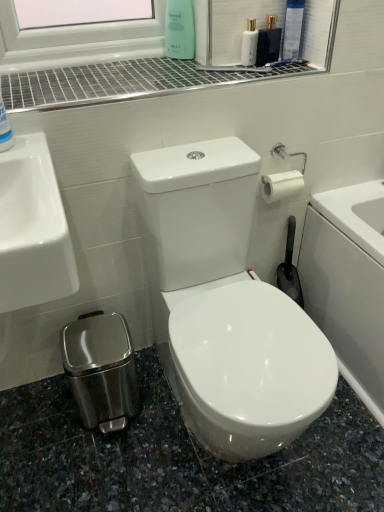
You are a GUI agent. You are given a task and a screenshot of the screen. Output one action in this format:
    pyautogui.click(x=<x>, y=<y>)
    Task: Click on the blue glossy bottle at upper left, which appears as the 2th cleaning product when viewed from the back
    This screenshot has height=512, width=384.
    Given the screenshot: What is the action you would take?
    pyautogui.click(x=5, y=129)

Where is `green matte bottle at upper center, which appears as the 1th cleaning product when viewed from the top`? The image size is (384, 512). green matte bottle at upper center, which appears as the 1th cleaning product when viewed from the top is located at coordinates (179, 29).

The width and height of the screenshot is (384, 512). I want to click on blue glossy bottle at upper left, positioned as the first cleaning product in bottom-to-top order, so click(5, 129).

Between point (247, 54) and point (254, 73), which one is positioned in front?

Point (254, 73)

From the image's perspective, would you say white glossy mouthwash at upper center is shown under metallic grid at upper center?

Incorrect, from the image's perspective, white glossy mouthwash at upper center is higher than metallic grid at upper center.

Is metallic grid at upper center at the back of white glossy mouthwash at upper center?

No, white glossy mouthwash at upper center is not facing the opposite direction of metallic grid at upper center.

Can metallic grid at upper center be found inside white glossy mouthwash at upper center?

No, metallic grid at upper center is not inside white glossy mouthwash at upper center.

Is metallic grid at upper center shorter than white glossy toilet at center?

Indeed, metallic grid at upper center has a lesser height compared to white glossy toilet at center.

How much distance is there between metallic grid at upper center and white glossy toilet at center?

A distance of 18.28 inches exists between metallic grid at upper center and white glossy toilet at center.

Which object is thinner, metallic grid at upper center or white glossy toilet at center?

metallic grid at upper center is thinner.

Consider the image. Is metallic grid at upper center bigger or smaller than white glossy toilet at center?

In the image, metallic grid at upper center appears to be smaller than white glossy toilet at center.

Looking at this image, from their relative heights in the image, would you say white glossy mouthwash at upper center is taller or shorter than green matte bottle at upper center, which is counted as the first cleaning product, starting from the right?

In the image, white glossy mouthwash at upper center appears to be shorter than green matte bottle at upper center, which is counted as the first cleaning product, starting from the right.

Is white glossy mouthwash at upper center next to green matte bottle at upper center, marked as the first cleaning product in a back-to-front arrangement, and touching it?

No, white glossy mouthwash at upper center is not with green matte bottle at upper center, marked as the first cleaning product in a back-to-front arrangement.

Is white glossy mouthwash at upper center oriented towards green matte bottle at upper center, which appears as the 1th cleaning product when viewed from the top?

No, white glossy mouthwash at upper center is not aimed at green matte bottle at upper center, which appears as the 1th cleaning product when viewed from the top.

Would you say white glossy mouthwash at upper center is inside or outside green matte bottle at upper center, which appears as the 1th cleaning product when viewed from the top?

white glossy mouthwash at upper center is not enclosed by green matte bottle at upper center, which appears as the 1th cleaning product when viewed from the top.

Relative to white glossy mouthwash at upper center, is white glossy toilet at center in front or behind?

white glossy toilet at center is positioned closer to the viewer than white glossy mouthwash at upper center.

Is white glossy toilet at center not close to white glossy mouthwash at upper center?

No, white glossy toilet at center is in close proximity to white glossy mouthwash at upper center.

Is white glossy toilet at center wider or thinner than white glossy mouthwash at upper center?

white glossy toilet at center is wider than white glossy mouthwash at upper center.

From the image's perspective, between white glossy toilet at center and white glossy mouthwash at upper center, which one is located above?

white glossy mouthwash at upper center appears higher in the image.

Is blue glossy bottle at upper left, acting as the 1th cleaning product starting from the front, not near green matte bottle at upper center, which is counted as the first cleaning product, starting from the right?

blue glossy bottle at upper left, acting as the 1th cleaning product starting from the front, is actually quite close to green matte bottle at upper center, which is counted as the first cleaning product, starting from the right.

Between blue glossy bottle at upper left, which appears as the 2th cleaning product when viewed from the back, and green matte bottle at upper center, which is counted as the first cleaning product, starting from the right, which one has less height?

With less height is blue glossy bottle at upper left, which appears as the 2th cleaning product when viewed from the back.

Is blue glossy bottle at upper left, which is counted as the second cleaning product, starting from the top, aimed at green matte bottle at upper center, marked as the first cleaning product in a back-to-front arrangement?

No, blue glossy bottle at upper left, which is counted as the second cleaning product, starting from the top, is not turned towards green matte bottle at upper center, marked as the first cleaning product in a back-to-front arrangement.

Locate an element on the screen. This screenshot has height=512, width=384. cleaning product below the metallic grid at upper center (from the image's perspective) is located at coordinates (5, 129).

Does metallic grid at upper center lie behind blue glossy bottle at upper left, acting as the 1th cleaning product starting from the front?

Yes, metallic grid at upper center is behind blue glossy bottle at upper left, acting as the 1th cleaning product starting from the front.

Is metallic grid at upper center spatially inside blue glossy bottle at upper left, placed as the 1th cleaning product when sorted from left to right, or outside of it?

metallic grid at upper center is located beyond the bounds of blue glossy bottle at upper left, placed as the 1th cleaning product when sorted from left to right.

Is point (57, 79) closer or farther from the camera than point (0, 131)?

Point (57, 79) appears to be farther away from the viewer than point (0, 131).

What's the angular difference between white glossy mouthwash at upper center and blue glossy bottle at upper left, placed as the 1th cleaning product when sorted from left to right,'s facing directions?

8.06 degrees.

Considering the points (252, 55) and (9, 148), which point is in front, point (252, 55) or point (9, 148)?

Positioned in front is point (9, 148).

Is white glossy mouthwash at upper center taller or shorter than blue glossy bottle at upper left, positioned as the 2th cleaning product in right-to-left order?

In the image, white glossy mouthwash at upper center appears to be shorter than blue glossy bottle at upper left, positioned as the 2th cleaning product in right-to-left order.

Is white glossy mouthwash at upper center thinner than blue glossy bottle at upper left, placed as the 1th cleaning product when sorted from left to right?

Yes.

The height and width of the screenshot is (512, 384). I want to click on mouthwash behind the metallic grid at upper center, so click(249, 44).

Image resolution: width=384 pixels, height=512 pixels. Find the location of `toilet below the metallic grid at upper center (from the image's perspective)`. toilet below the metallic grid at upper center (from the image's perspective) is located at coordinates (225, 305).

Estimate the real-world distances between objects in this image. Which object is further from green matte bottle at upper center, which appears as the 1th cleaning product when viewed from the top, blue glossy bottle at upper left, positioned as the first cleaning product in bottom-to-top order, or white glossy toilet at center?

Among the two, white glossy toilet at center is located further to green matte bottle at upper center, which appears as the 1th cleaning product when viewed from the top.

Based on their spatial positions, is white glossy toilet at center or green matte bottle at upper center, which appears as the 1th cleaning product when viewed from the top, closer to blue glossy bottle at upper left, which appears as the 2th cleaning product when viewed from the back?

white glossy toilet at center is positioned closer to the anchor blue glossy bottle at upper left, which appears as the 2th cleaning product when viewed from the back.

When comparing their distances from white glossy toilet at center, does metallic grid at upper center or white glossy mouthwash at upper center seem further?

white glossy mouthwash at upper center.

Which object lies nearer to the anchor point green matte bottle at upper center, which appears as the 1th cleaning product when viewed from the top, metallic grid at upper center or blue glossy bottle at upper left, which is counted as the second cleaning product, starting from the top?

metallic grid at upper center lies closer to green matte bottle at upper center, which appears as the 1th cleaning product when viewed from the top, than the other object.

Based on their spatial positions, is white glossy mouthwash at upper center or blue glossy bottle at upper left, acting as the 1th cleaning product starting from the front, further from white glossy toilet at center?

white glossy mouthwash at upper center is positioned further to the anchor white glossy toilet at center.

When comparing their distances from green matte bottle at upper center, which ranks as the 2th cleaning product in bottom-to-top order, does blue glossy bottle at upper left, acting as the 1th cleaning product starting from the front, or white glossy mouthwash at upper center seem further?

blue glossy bottle at upper left, acting as the 1th cleaning product starting from the front, lies further to green matte bottle at upper center, which ranks as the 2th cleaning product in bottom-to-top order, than the other object.

Considering their positions, is white glossy mouthwash at upper center positioned further to metallic grid at upper center than white glossy toilet at center?

white glossy toilet at center is further to metallic grid at upper center.

Which object lies further to the anchor point blue glossy bottle at upper left, which appears as the 2th cleaning product when viewed from the back, white glossy toilet at center or metallic grid at upper center?

Answer: Based on the image, white glossy toilet at center appears to be further to blue glossy bottle at upper left, which appears as the 2th cleaning product when viewed from the back.

I want to click on cleaning product between green matte bottle at upper center, which ranks as the 2th cleaning product in bottom-to-top order, and white glossy toilet at center from top to bottom, so click(x=5, y=129).

You are a GUI agent. You are given a task and a screenshot of the screen. Output one action in this format:
    pyautogui.click(x=<x>, y=<y>)
    Task: Click on the window sill between green matte bottle at upper center, which ranks as the 2th cleaning product in bottom-to-top order, and white glossy toilet at center, in the vertical direction
    This screenshot has height=512, width=384.
    Given the screenshot: What is the action you would take?
    pyautogui.click(x=125, y=81)

Locate an element on the screen. This screenshot has width=384, height=512. cleaning product situated between metallic grid at upper center and white glossy mouthwash at upper center from left to right is located at coordinates (179, 29).

Where is `mouthwash between green matte bottle at upper center, marked as the first cleaning product in a back-to-front arrangement, and white glossy toilet at center, in the vertical direction`? Image resolution: width=384 pixels, height=512 pixels. mouthwash between green matte bottle at upper center, marked as the first cleaning product in a back-to-front arrangement, and white glossy toilet at center, in the vertical direction is located at coordinates (249, 44).